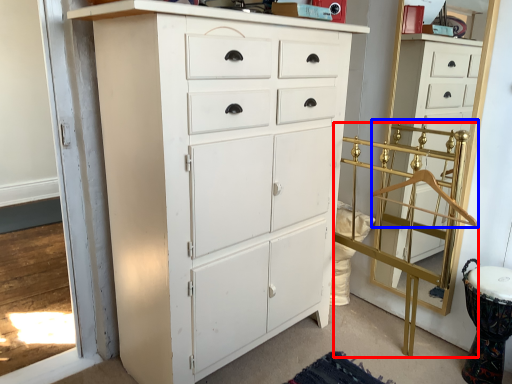
Question: Which object is closer to the camera taking this photo, bunk bed (highlighted by a red box) or hanger (highlighted by a blue box)?

Choices:
 (A) bunk bed
 (B) hanger

Answer: (A)